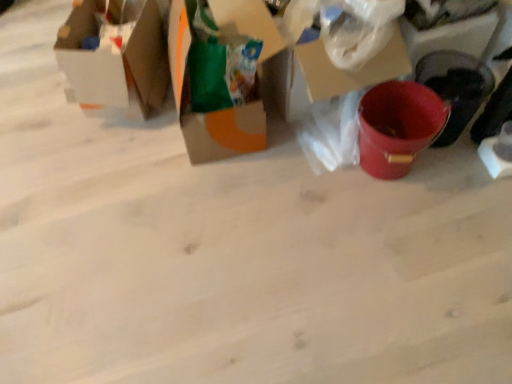
Question: From a real-world perspective, is cardboard box at center, the 2th box viewed from the left, positioned above or below matte cardboard box at upper left, the 1th box viewed from the left?

Choices:
 (A) above
 (B) below

Answer: (A)

Question: In terms of height, does cardboard box at center, the 2th box viewed from the left, look taller or shorter compared to matte cardboard box at upper left, which ranks as the second box in right-to-left order?

Choices:
 (A) tall
 (B) short

Answer: (A)

Question: Considering their positions, is cardboard box at center, the 2th box viewed from the left, located in front of or behind matte cardboard box at upper left, the 1th box viewed from the left?

Choices:
 (A) front
 (B) behind

Answer: (A)

Question: Is point (126, 61) closer or farther from the camera than point (185, 34)?

Choices:
 (A) closer
 (B) farther

Answer: (B)

Question: Choose the correct answer: Is matte cardboard box at upper left, which ranks as the second box in right-to-left order, inside cardboard box at center, the 2th box viewed from the left, or outside it?

Choices:
 (A) outside
 (B) inside

Answer: (A)

Question: From a real-world perspective, relative to cardboard box at center, the 2th box viewed from the left, is matte cardboard box at upper left, the 1th box viewed from the left, vertically above or below?

Choices:
 (A) below
 (B) above

Answer: (A)

Question: In terms of size, does matte cardboard box at upper left, the 1th box viewed from the left, appear bigger or smaller than cardboard box at center, the 2th box viewed from the left?

Choices:
 (A) big
 (B) small

Answer: (B)